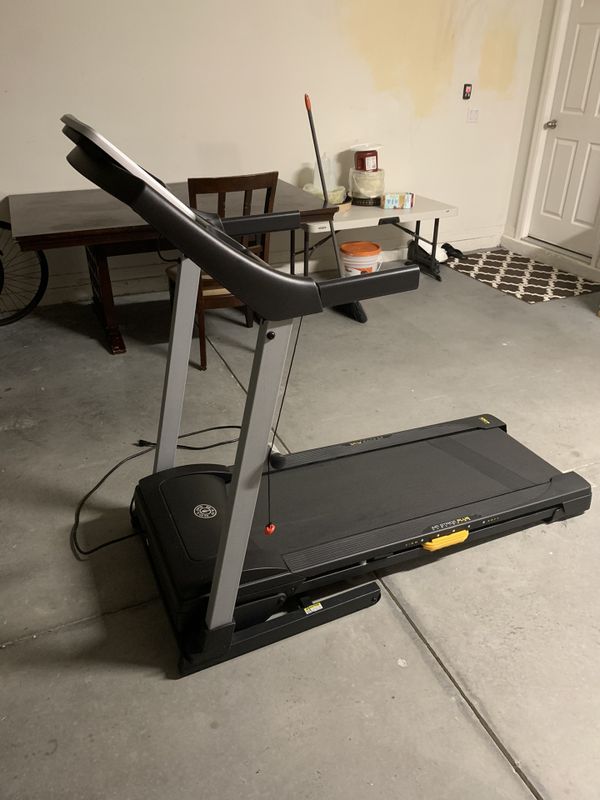
At what (x,y) coordinates should I click in order to perform the action: click on door. Please return your answer as a coordinate pair (x, y). Looking at the image, I should click on (552, 245).